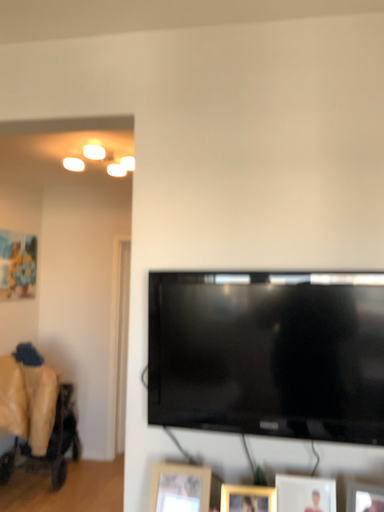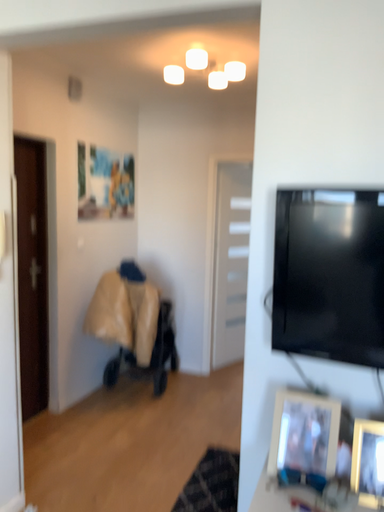
Question: How did the camera likely rotate when shooting the video?

Choices:
 (A) rotated downward
 (B) rotated upward

Answer: (A)